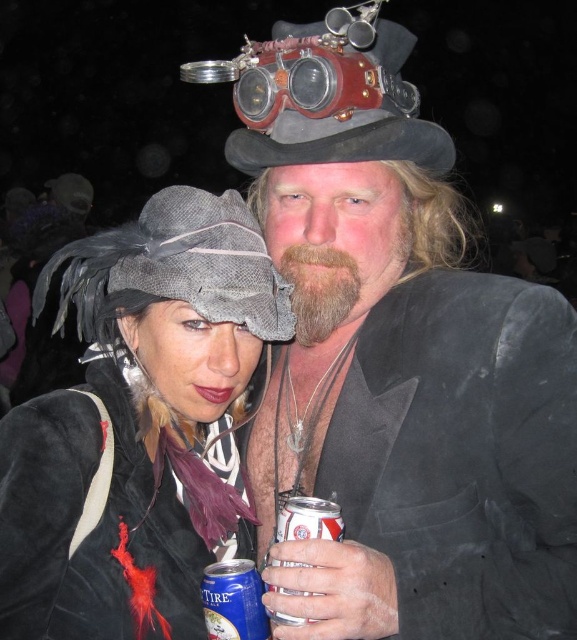
Question: Does blue metallic can at lower left come behind blue metallic can at lower center?

Choices:
 (A) yes
 (B) no

Answer: (A)

Question: Which point is farther from the camera taking this photo?

Choices:
 (A) (100, 636)
 (B) (227, 576)
 (C) (462, 340)
 (D) (295, 124)

Answer: (D)

Question: Which object appears closest to the camera in this image?

Choices:
 (A) felt hat at upper left
 (B) blue metallic can at lower left
 (C) steampunk leather goggles at center
 (D) felt/textured hat at upper center

Answer: (B)

Question: Which of the following is the closest to the observer?

Choices:
 (A) steampunk leather goggles at center
 (B) blue metallic can at lower left

Answer: (B)

Question: Does velvet black suit at center have a larger size compared to blue metallic can at lower center?

Choices:
 (A) yes
 (B) no

Answer: (A)

Question: Is steampunk leather goggles at center smaller than blue metallic can at lower center?

Choices:
 (A) yes
 (B) no

Answer: (B)